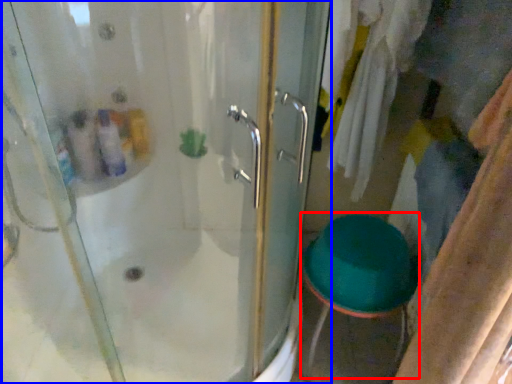
Question: Which point is closer to the camera, step stool (highlighted by a red box) or door (highlighted by a blue box)?

Choices:
 (A) step stool
 (B) door

Answer: (B)